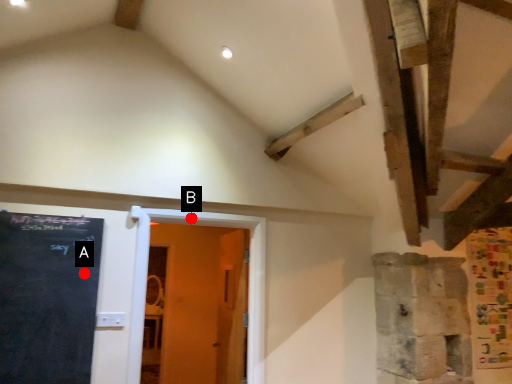
Question: Two points are circled on the image, labeled by A and B beside each circle. Which point appears closest to the camera in this image?

Choices:
 (A) A is closer
 (B) B is closer

Answer: (A)